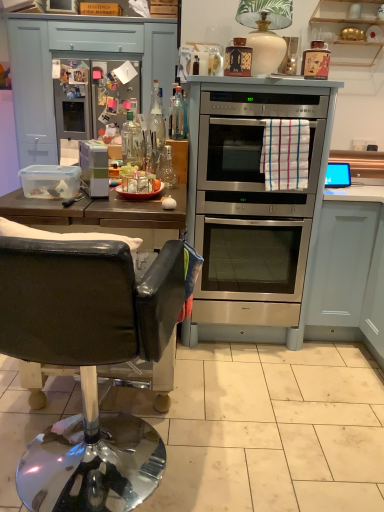
What do you see at coordinates (94, 168) in the screenshot?
I see `white plastic container at left, the first appliance positioned from the left` at bounding box center [94, 168].

What do you see at coordinates (88, 362) in the screenshot?
I see `black leather chair at left` at bounding box center [88, 362].

The height and width of the screenshot is (512, 384). What are the coordinates of `matte blue drawer at upper left` in the screenshot? It's located at (96, 37).

In order to click on silver metallic oven at center, which is counted as the 1th appliance, starting from the right in this screenshot , I will do `click(337, 175)`.

Looking at this image, how much space does silver metallic oven at center, which appears as the 2th appliance when viewed from the top, occupy horizontally?

It is 2.99 inches.

Locate an element on the screen. The height and width of the screenshot is (512, 384). stainless steel oven at center is located at coordinates (251, 133).

From a real-world perspective, between stainless steel oven at center and wooden shelves at upper right, the first cabinetry from the top, who is vertically lower?

stainless steel oven at center, from a real-world perspective.

Is stainless steel oven at center surrounding wooden shelves at upper right, which is counted as the 2th cabinetry, starting from the bottom?

No, wooden shelves at upper right, which is counted as the 2th cabinetry, starting from the bottom, is located outside of stainless steel oven at center.

Does stainless steel oven at center have a lesser height compared to wooden shelves at upper right, the first cabinetry from the top?

Incorrect, the height of stainless steel oven at center does not fall short of that of wooden shelves at upper right, the first cabinetry from the top.

Does point (312, 163) appear closer or farther from the camera than point (317, 31)?

Point (312, 163).

Considering the points (304, 74) and (370, 57), which point is behind, point (304, 74) or point (370, 57)?

Point (370, 57)

From a real-world perspective, who is located higher, matte black bottle at upper right, which appears as the 3th appliance when ordered from the bottom, or wooden shelves at upper right, the first cabinetry from the top?

wooden shelves at upper right, the first cabinetry from the top, is physically above.

Is the position of matte black bottle at upper right, the first appliance from the top, more distant than that of wooden shelves at upper right, the first cabinetry from the top?

No, matte black bottle at upper right, the first appliance from the top, is closer to the camera.

Is point (64, 295) less distant than point (98, 143)?

That is True.

From a real-world perspective, is black leather chair at left above or below white plastic container at left, the third appliance positioned from the back?

In terms of real-world spatial position, black leather chair at left is below white plastic container at left, the third appliance positioned from the back.

Based on the photo, is black leather chair at left positioned before white plastic container at left, the third appliance positioned from the back?

Yes.

Is black leather chair at left inside the boundaries of white plastic container at left, which is the 1th appliance in bottom-to-top order, or outside?

black leather chair at left is not inside white plastic container at left, which is the 1th appliance in bottom-to-top order, it's outside.

Is white plastic container at left, which is the 1th appliance in bottom-to-top order, positioned beyond the bounds of matte black bottle at upper right, the 2th appliance viewed from the back?

Yes, white plastic container at left, which is the 1th appliance in bottom-to-top order, is outside of matte black bottle at upper right, the 2th appliance viewed from the back.

Is white plastic container at left, the third appliance positioned from the back, closer to the viewer compared to matte black bottle at upper right, the 2th appliance viewed from the back?

Yes, it is in front of matte black bottle at upper right, the 2th appliance viewed from the back.

Locate an element on the screen. The height and width of the screenshot is (512, 384). the 1st appliance behind the white plastic container at left, the first appliance positioned from the left is located at coordinates (316, 61).

Based on their sizes in the image, would you say white plastic container at left, marked as the third appliance in a right-to-left arrangement, is bigger or smaller than matte black bottle at upper right, which appears as the 3th appliance when ordered from the bottom?

Clearly, white plastic container at left, marked as the third appliance in a right-to-left arrangement, is larger in size than matte black bottle at upper right, which appears as the 3th appliance when ordered from the bottom.

Relative to satin silver fridge at upper left, is silver metallic oven at center, positioned as the 1th appliance in back-to-front order, in front or behind?

Visually, silver metallic oven at center, positioned as the 1th appliance in back-to-front order, is located in front of satin silver fridge at upper left.

From the image's perspective, relative to satin silver fridge at upper left, is silver metallic oven at center, which appears as the 2th appliance when viewed from the top, above or below?

Clearly, from the image's perspective, silver metallic oven at center, which appears as the 2th appliance when viewed from the top, is below satin silver fridge at upper left.

Does point (344, 167) come in front of point (66, 68)?

That is True.

Is silver metallic oven at center, positioned as the 1th appliance in back-to-front order, turned away from satin silver fridge at upper left?

No, silver metallic oven at center, positioned as the 1th appliance in back-to-front order, is not facing away from satin silver fridge at upper left.

How much distance is there between satin silver fridge at upper left and wooden shelves at upper right, which is counted as the 2th cabinetry, starting from the bottom?

A distance of 2.72 meters exists between satin silver fridge at upper left and wooden shelves at upper right, which is counted as the 2th cabinetry, starting from the bottom.

Is the surface of satin silver fridge at upper left in direct contact with wooden shelves at upper right, the first cabinetry from the top?

No, satin silver fridge at upper left is not in contact with wooden shelves at upper right, the first cabinetry from the top.

Which object is wider, satin silver fridge at upper left or wooden shelves at upper right, which is counted as the 2th cabinetry, starting from the bottom?

satin silver fridge at upper left is wider.

At what (x,y) coordinates should I click in order to perform the action: click on cabinetry above the satin silver fridge at upper left (from a real-world perspective). Please return your answer as a coordinate pair (x, y). Image resolution: width=384 pixels, height=512 pixels. Looking at the image, I should click on (346, 27).

Does matte blue drawer at upper left turn towards satin silver fridge at upper left?

No, matte blue drawer at upper left is not turned towards satin silver fridge at upper left.

Visually, is matte blue drawer at upper left positioned to the left or to the right of satin silver fridge at upper left?

matte blue drawer at upper left is to the right of satin silver fridge at upper left.

Based on the photo, from a real-world perspective, is matte blue drawer at upper left on top of satin silver fridge at upper left?

Yes, from a real-world perspective, matte blue drawer at upper left is over satin silver fridge at upper left

Where is `oven that appears in front of the wooden shelves at upper right, which is counted as the 2th cabinetry, starting from the bottom`? oven that appears in front of the wooden shelves at upper right, which is counted as the 2th cabinetry, starting from the bottom is located at coordinates (251, 133).

Find the location of a particular element. This screenshot has height=512, width=384. cabinetry that is the 1st object to the right of the matte black bottle at upper right, the first appliance from the top, starting at the anchor is located at coordinates (346, 27).

Which object lies further to the anchor point satin silver fridge at upper left, clear glass bottle at center or matte blue drawer at upper left?

clear glass bottle at center.

When comparing their distances from silver metallic oven at center, arranged as the 3th appliance when viewed from the left, does matte black bottle at upper right, which appears as the 3th appliance when ordered from the bottom, or wooden shelves at upper right, the first cabinetry from the top, seem closer?

matte black bottle at upper right, which appears as the 3th appliance when ordered from the bottom, lies closer to silver metallic oven at center, arranged as the 3th appliance when viewed from the left, than the other object.

Which object lies nearer to the anchor point clear glass bottle at center, white plastic container at left, the 3th appliance from the top, or wooden shelves at upper right, which is counted as the 2th cabinetry, starting from the bottom?

Based on the image, white plastic container at left, the 3th appliance from the top, appears to be nearer to clear glass bottle at center.

Based on their spatial positions, is satin silver fridge at upper left or clear glass bottle at center closer to white matte cabinet at lower right, marked as the 2th cabinetry in a top-to-bottom arrangement?

clear glass bottle at center is closer to white matte cabinet at lower right, marked as the 2th cabinetry in a top-to-bottom arrangement.

Based on their spatial positions, is matte blue drawer at upper left or silver metallic oven at center, arranged as the 3th appliance when viewed from the left, further from matte black bottle at upper right, which is counted as the second appliance, starting from the front?

The object further to matte black bottle at upper right, which is counted as the second appliance, starting from the front, is matte blue drawer at upper left.

Which object lies nearer to the anchor point white plastic container at left, the 3th appliance from the top, satin silver fridge at upper left or matte blue drawer at upper left?

The object closer to white plastic container at left, the 3th appliance from the top, is satin silver fridge at upper left.

Based on their spatial positions, is stainless steel oven at center or matte blue drawer at upper left further from matte black bottle at upper right, marked as the second appliance in a left-to-right arrangement?

Among the two, matte blue drawer at upper left is located further to matte black bottle at upper right, marked as the second appliance in a left-to-right arrangement.

Based on the photo, which object lies nearer to the anchor point matte blue drawer at upper left, white plastic container at left, the first appliance positioned from the left, or black leather chair at left?

white plastic container at left, the first appliance positioned from the left, lies closer to matte blue drawer at upper left than the other object.

Where is `oven situated between white plastic container at left, the 3th appliance from the top, and silver metallic oven at center, which appears as the 2th appliance when viewed from the top, from left to right`? Image resolution: width=384 pixels, height=512 pixels. oven situated between white plastic container at left, the 3th appliance from the top, and silver metallic oven at center, which appears as the 2th appliance when viewed from the top, from left to right is located at coordinates (251, 133).

Where is `bottle located between matte black bottle at upper right, the first appliance from the top, and satin silver fridge at upper left in the depth direction`? Image resolution: width=384 pixels, height=512 pixels. bottle located between matte black bottle at upper right, the first appliance from the top, and satin silver fridge at upper left in the depth direction is located at coordinates (131, 141).

Locate an element on the screen. bottle situated between white plastic container at left, which is the 1th appliance in bottom-to-top order, and stainless steel oven at center from left to right is located at coordinates (131, 141).

Locate an element on the screen. This screenshot has height=512, width=384. bottle between white plastic container at left, the first appliance positioned from the left, and wooden shelves at upper right, the first cabinetry from the top, in the horizontal direction is located at coordinates (131, 141).